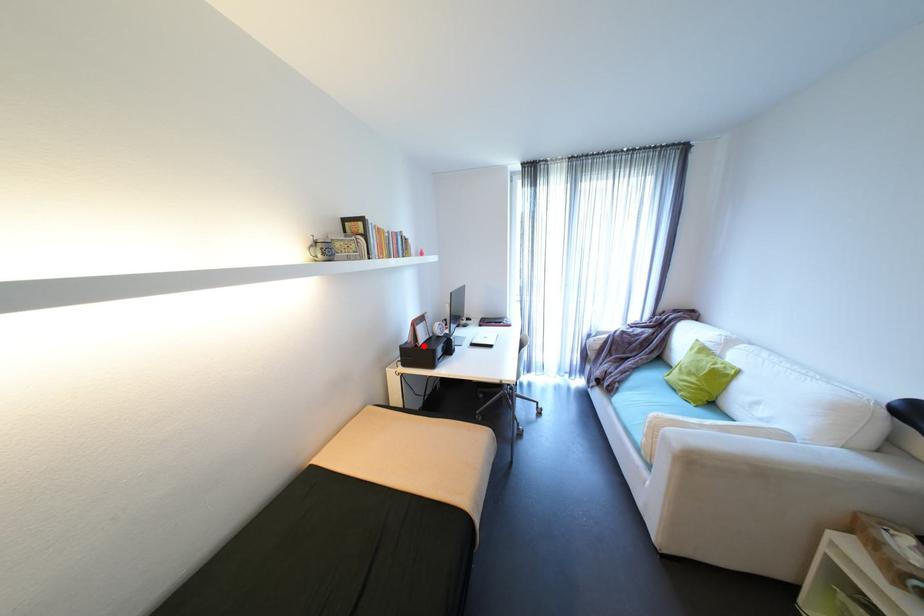
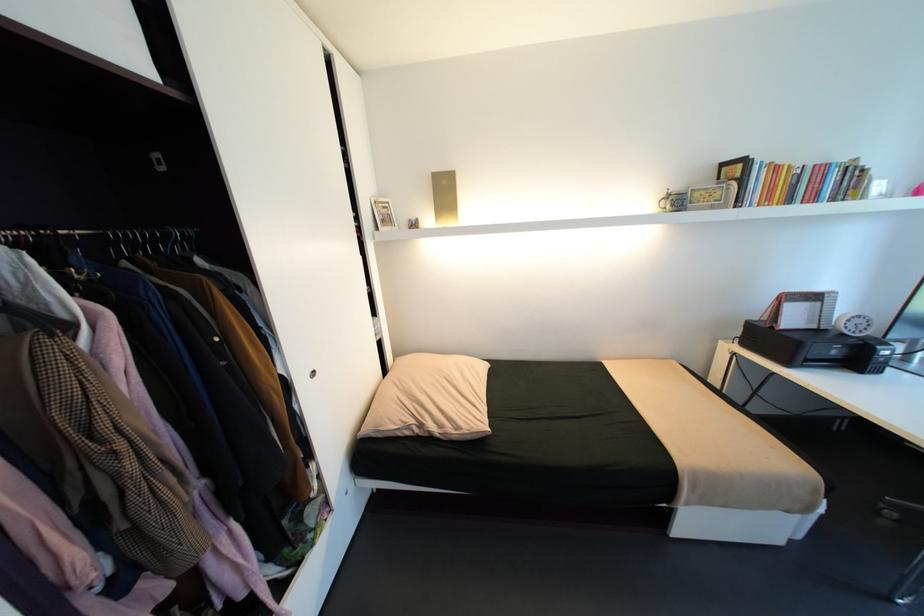
The point at the highlighted location is marked in the first image. Where is the corresponding point in the second image?

(779, 328)